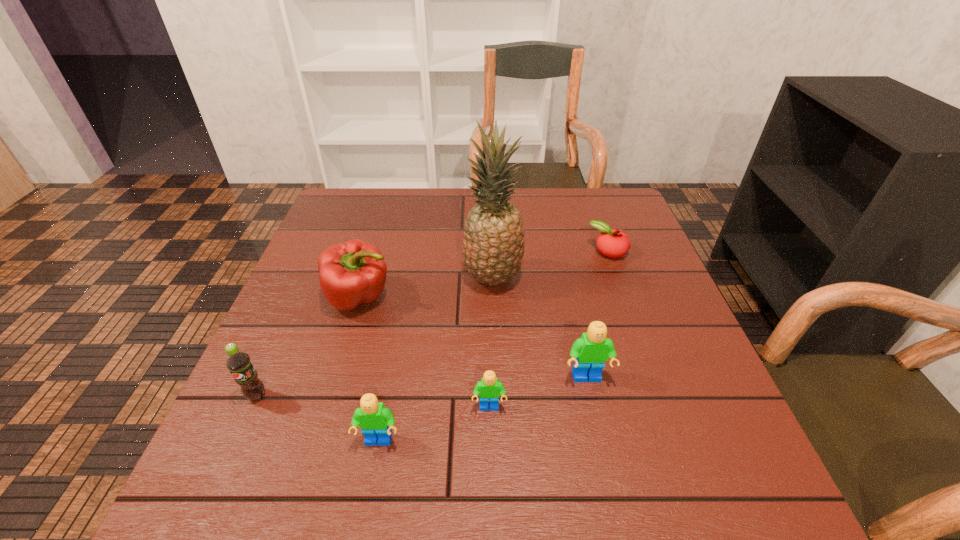
At what (x,y) coordinates should I click in order to perform the action: click on vacant area that lies between the second tallest Lego and the apple. Please return your answer as a coordinate pair (x, y). Looking at the image, I should click on (493, 347).

I want to click on vacant point located between the second Lego from right to left and the leftmost Lego, so click(434, 424).

I want to click on unoccupied position between the tallest object and the farthest Lego, so click(540, 328).

I want to click on empty space that is in between the shortest object and the pineapple, so click(550, 265).

Locate an element on the screen. Image resolution: width=960 pixels, height=540 pixels. free space between the bell pepper and the nearest Lego is located at coordinates (370, 369).

Find the location of a particular element. The width and height of the screenshot is (960, 540). free spot between the soda and the rightmost Lego is located at coordinates (422, 387).

The height and width of the screenshot is (540, 960). What are the coordinates of `free space that is in between the leftmost object and the tallest object` in the screenshot? It's located at (375, 337).

Identify the location of the third closest object relative to the second farthest Lego. (494, 241).

At what (x,y) coordinates should I click in order to perform the action: click on object that is the sixth closest one to the apple. Please return your answer as a coordinate pair (x, y). The height and width of the screenshot is (540, 960). Looking at the image, I should click on (238, 362).

Locate an element on the screen. This screenshot has height=540, width=960. Lego that is the second closest to the rightmost Lego is located at coordinates (375, 421).